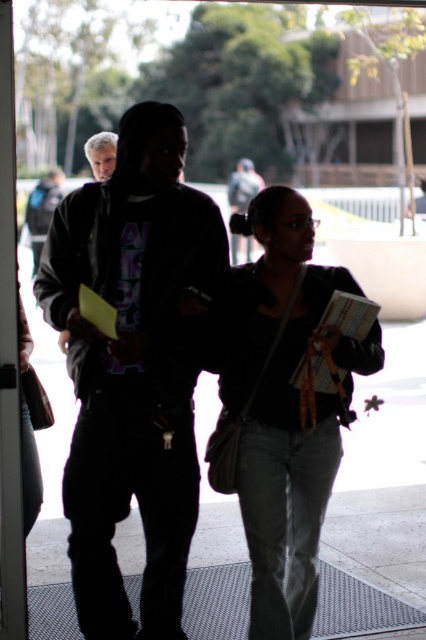
Can you confirm if gray rubber mat at lower center is positioned to the right of matte black hoodie at center?

Correct, you'll find gray rubber mat at lower center to the right of matte black hoodie at center.

Who is higher up, gray rubber mat at lower center or matte black hoodie at center?

matte black hoodie at center is higher up.

Does point (224, 544) come farther from viewer compared to point (92, 157)?

No, it is not.

In order to click on gray rubber mat at lower center in this screenshot , I will do `click(379, 538)`.

Identify the location of denim jeans at center. The image size is (426, 640). (284, 404).

Find the location of a particular element. The width and height of the screenshot is (426, 640). denim jeans at center is located at coordinates (284, 404).

Find the location of a particular element. denim jeans at center is located at coordinates [284, 404].

Is dark matte jacket at center smaller than denim jeans at center?

No.

Is dark matte jacket at center positioned at the back of denim jeans at center?

Yes.

Which is behind, point (213, 268) or point (328, 352)?

The point (213, 268) is behind.

This screenshot has height=640, width=426. Identify the location of dark matte jacket at center. (132, 369).